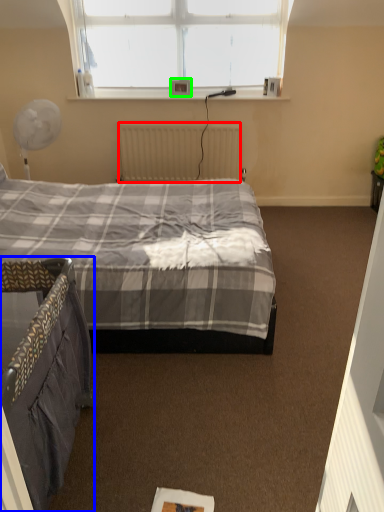
Question: Which is farther away from radiator (highlighted by a red box)? bed (highlighted by a blue box) or picture frame (highlighted by a green box)?

Choices:
 (A) bed
 (B) picture frame

Answer: (A)